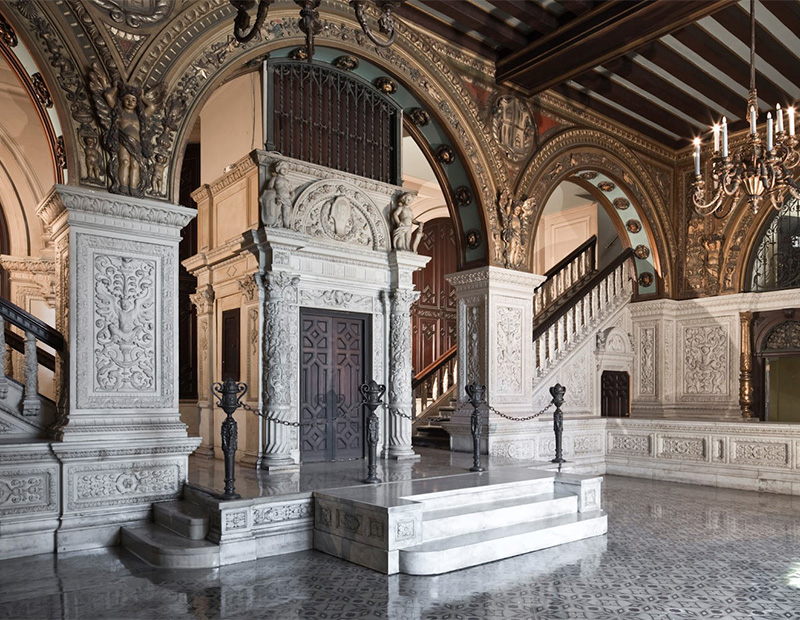
Identify the location of doorway. Image resolution: width=800 pixels, height=620 pixels. (760, 365).